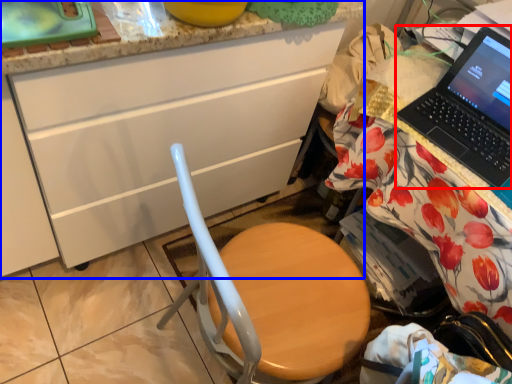
Question: Which object is closer to the camera taking this photo, laptop (highlighted by a red box) or cabinetry (highlighted by a blue box)?

Choices:
 (A) laptop
 (B) cabinetry

Answer: (B)